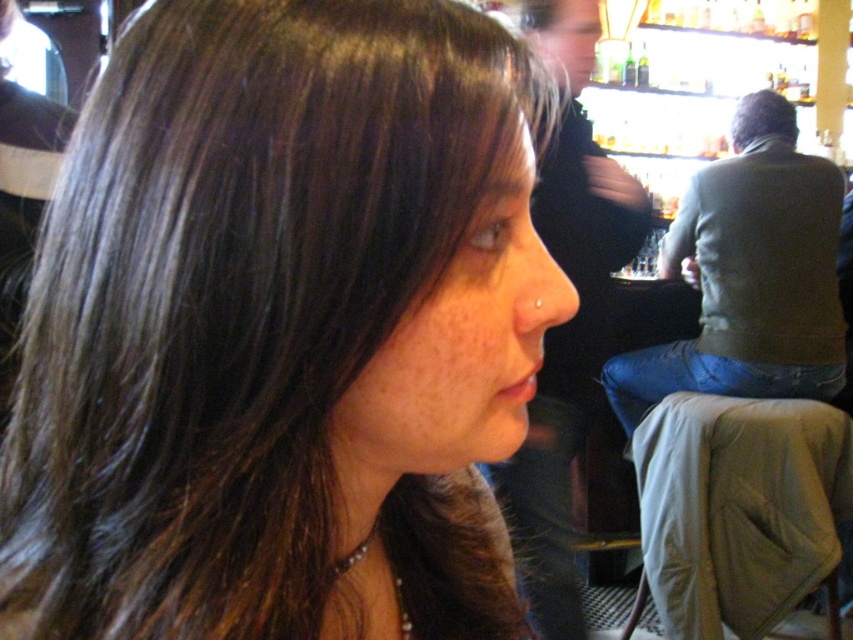
In the scene shown: Is dark brown hair at center above dark brown hair at upper right?

No.

Does dark brown hair at center come behind dark brown hair at upper right?

No, dark brown hair at center is in front of dark brown hair at upper right.

Which is in front, point (183, 16) or point (749, 113)?

Positioned in front is point (183, 16).

You are a GUI agent. You are given a task and a screenshot of the screen. Output one action in this format:
    pyautogui.click(x=<x>, y=<y>)
    Task: Click on the dark brown hair at center
    
    Given the screenshot: What is the action you would take?
    pyautogui.click(x=281, y=332)